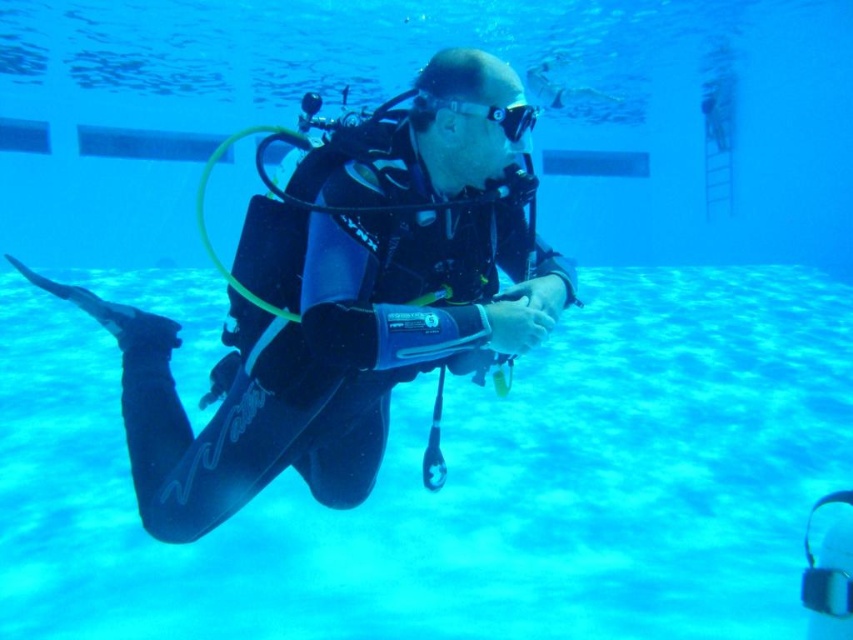
You are a lifeguard observing the blue matte swimming pool at center and the black matte scuba diver at center. Which object takes up more space in the image?

The blue matte swimming pool at center is larger in size than the black matte scuba diver at center, so it takes up more space in the image.

You are a lifeguard standing at the edge of the pool. There is a blue matte swimming pool at center located at point (465, 483). Can you see the scuba diver from your position?

The blue matte swimming pool at center is located at point (465, 483), which is the center of the pool. Since the scuba diver is the primary subject in the underwater scene, they are likely positioned near the center where the pool is visible from the edge. Therefore, yes, you can see the scuba diver from your position at the edge of the pool.

You are a swimmer trying to locate the black matte scuba diver at center in the blue matte swimming pool at center. Based on the scene, which side of the diver should you look towards to find the pool?

The blue matte swimming pool at center is positioned on the right side of the black matte scuba diver at center, so you should look towards the right side of the diver to find the pool.